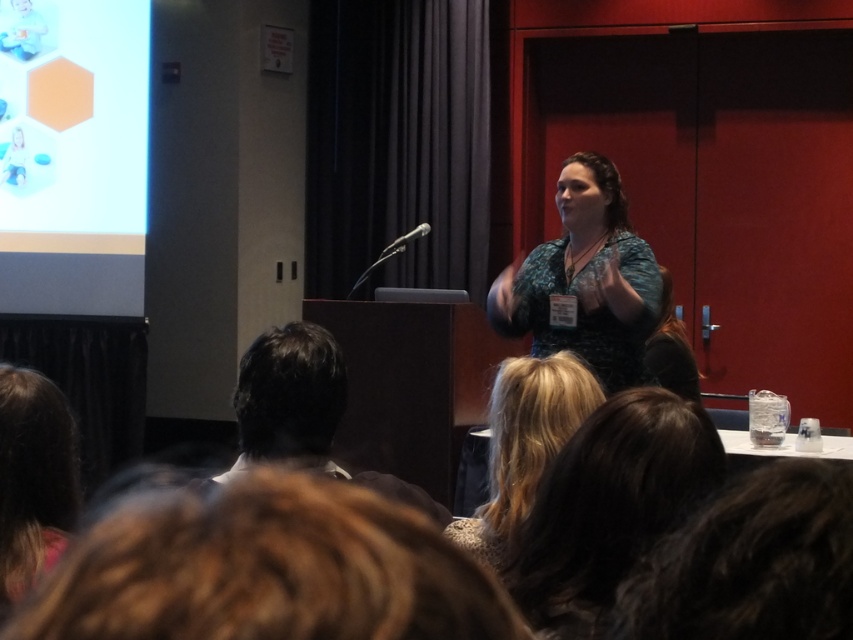
Question: Which object is farther from the camera taking this photo?

Choices:
 (A) dark brown hair at lower left
 (B) brown hair at lower left

Answer: (A)

Question: Does white glossy hexagon at upper left have a larger size compared to brown hair at lower left?

Choices:
 (A) no
 (B) yes

Answer: (B)

Question: Which of the following is the closest to the observer?

Choices:
 (A) (44, 448)
 (B) (97, 61)
 (C) (643, 316)
 (D) (564, 394)

Answer: (A)

Question: Is the position of brown hair at lower left more distant than that of blonde hair at center?

Choices:
 (A) yes
 (B) no

Answer: (B)

Question: Which of the following is the farthest from the observer?

Choices:
 (A) brown hair at lower center
 (B) brown hair at lower left
 (C) dark brown hair at lower left
 (D) white glossy hexagon at upper left

Answer: (D)

Question: Can you confirm if matte green dress at center is positioned to the right of brown hair at lower left?

Choices:
 (A) yes
 (B) no

Answer: (A)